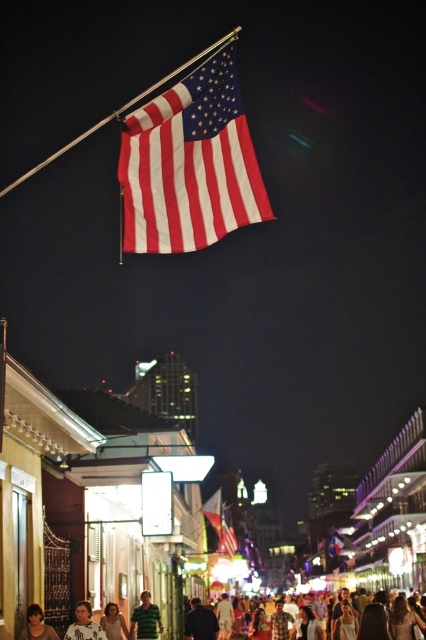
Which is in front, point (218, 150) or point (83, 602)?

Point (218, 150) is more forward.

Which of these two, matte fabric flag at upper center or white shirt at center, stands shorter?

With less height is white shirt at center.

Find the location of a particular element. The image size is (426, 640). matte fabric flag at upper center is located at coordinates (189, 163).

Which is behind, point (77, 634) or point (233, 540)?

The point (233, 540) is behind.

Based on the photo, is white shirt at center to the right of matte fabric flag at center from the viewer's perspective?

No, white shirt at center is not to the right of matte fabric flag at center.

This screenshot has width=426, height=640. Find the location of `white shirt at center`. white shirt at center is located at coordinates (83, 625).

Between matte fabric flag at upper center and smooth brown hair at lower left, which one has less height?

smooth brown hair at lower left is shorter.

Which of these two, matte fabric flag at upper center or smooth brown hair at lower left, stands taller?

matte fabric flag at upper center is taller.

Is point (178, 122) closer to camera compared to point (29, 616)?

That is True.

I want to click on matte fabric flag at upper center, so click(189, 163).